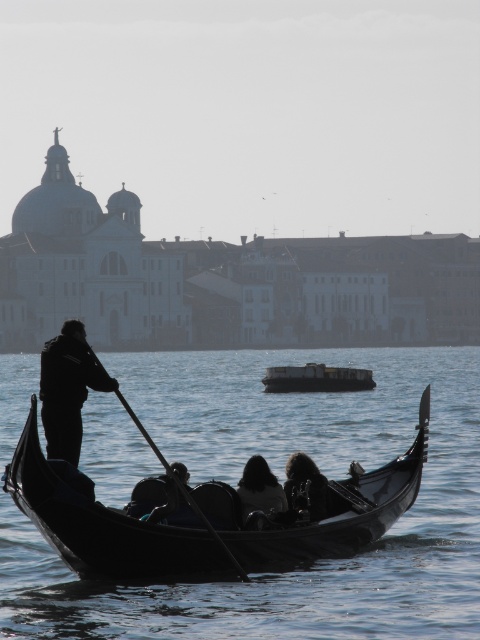
Question: Which object appears closest to the camera in this image?

Choices:
 (A) metallic gray barge at center
 (B) black polished gondola at center

Answer: (B)

Question: Which point is farther to the camera?

Choices:
 (A) pyautogui.click(x=256, y=496)
 (B) pyautogui.click(x=73, y=502)
 (C) pyautogui.click(x=205, y=524)
 (D) pyautogui.click(x=85, y=387)

Answer: (D)

Question: From the image, what is the correct spatial relationship of black polished gondola at center in relation to dark brown leather jacket at center?

Choices:
 (A) above
 (B) below

Answer: (A)

Question: Is black polished gondola at center to the right of dark hair at center from the viewer's perspective?

Choices:
 (A) no
 (B) yes

Answer: (B)

Question: Considering the real-world distances, which object is closest to the dark brown leather jacket at center?

Choices:
 (A) black polished gondola at center
 (B) metallic gray barge at center

Answer: (A)

Question: Is black polished gondola at center further to the viewer compared to dark hair at center?

Choices:
 (A) no
 (B) yes

Answer: (A)